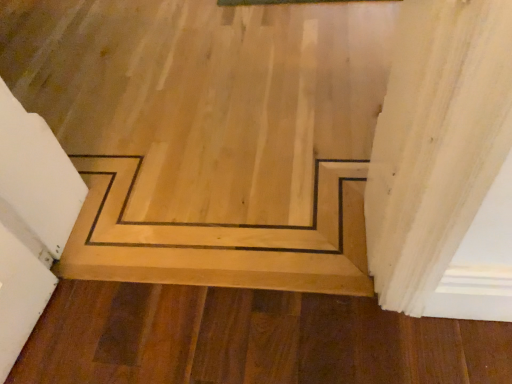
Measure the distance between point (355, 347) and camera.

Point (355, 347) and camera are 1.02 meters apart from each other.

What do you see at coordinates (249, 339) in the screenshot? I see `natural wood floor at lower center` at bounding box center [249, 339].

Where is `natural wood floor at lower center`? The width and height of the screenshot is (512, 384). natural wood floor at lower center is located at coordinates (249, 339).

Locate an element on the screen. natural wood floor at lower center is located at coordinates (249, 339).